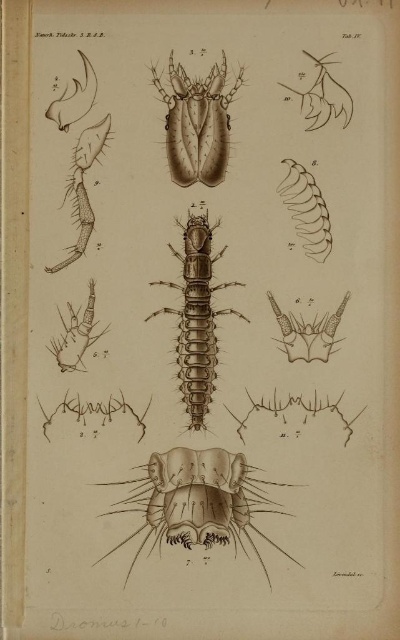
Can you confirm if brown textured centipede at center is bigger than brown textured insect at center?

Indeed, brown textured centipede at center has a larger size compared to brown textured insect at center.

Who is lower down, brown textured centipede at center or brown textured insect at center?

brown textured centipede at center is lower down.

Which is in front, point (196, 428) or point (212, 179)?

Point (196, 428) is in front.

The width and height of the screenshot is (400, 640). What are the coordinates of `brown textured centipede at center` in the screenshot? It's located at (196, 317).